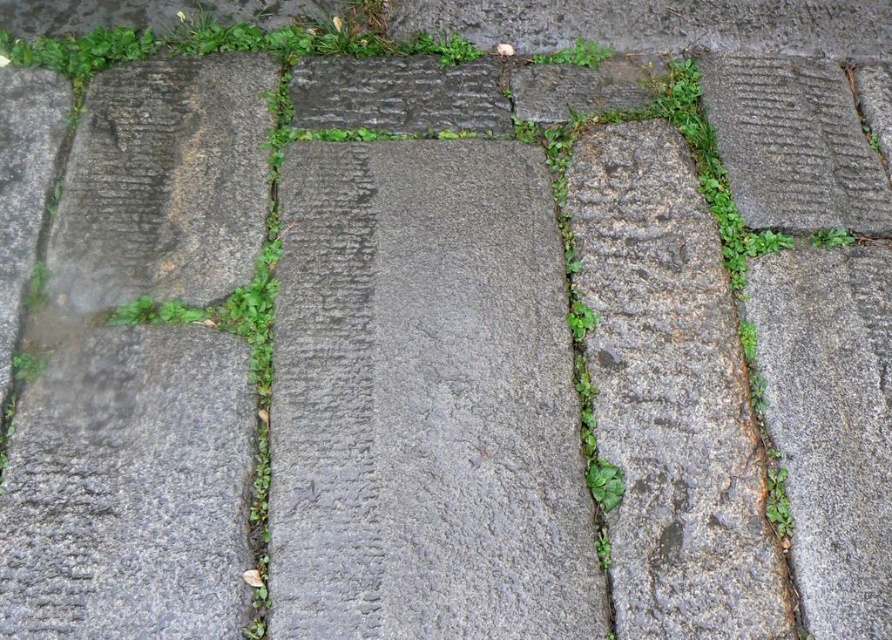
Question: Does gray rough stone at center appear on the left side of green leafy grass at upper center?

Choices:
 (A) no
 (B) yes

Answer: (B)

Question: Is gray rough stone at center to the right of green leafy grass at upper center from the viewer's perspective?

Choices:
 (A) yes
 (B) no

Answer: (B)

Question: Among these objects, which one is farthest from the camera?

Choices:
 (A) green leafy grass at upper center
 (B) gray rough stone at center

Answer: (A)

Question: Which of the following is the farthest from the observer?

Choices:
 (A) (588, 48)
 (B) (492, 172)

Answer: (A)

Question: Is gray rough stone at center to the left of green leafy grass at upper center from the viewer's perspective?

Choices:
 (A) yes
 (B) no

Answer: (A)